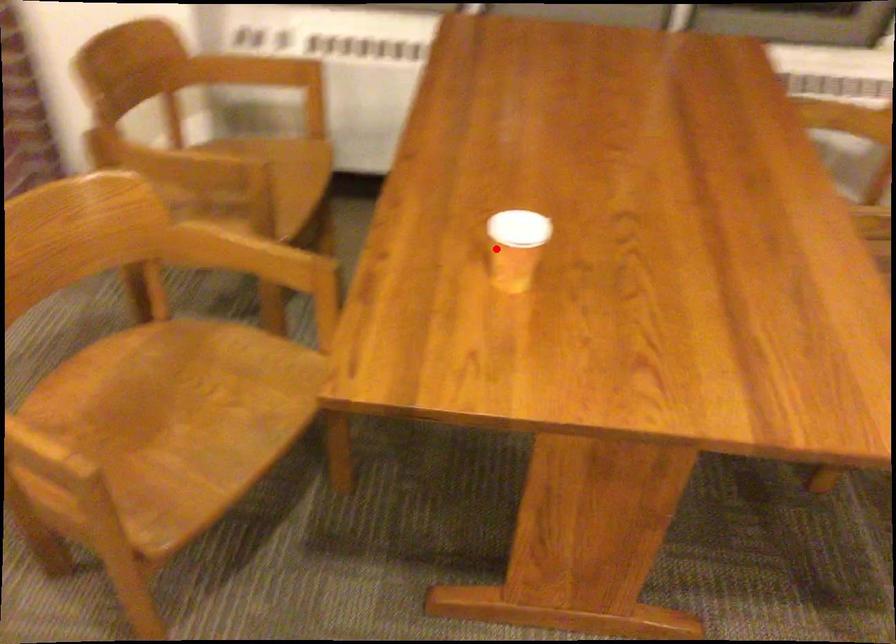
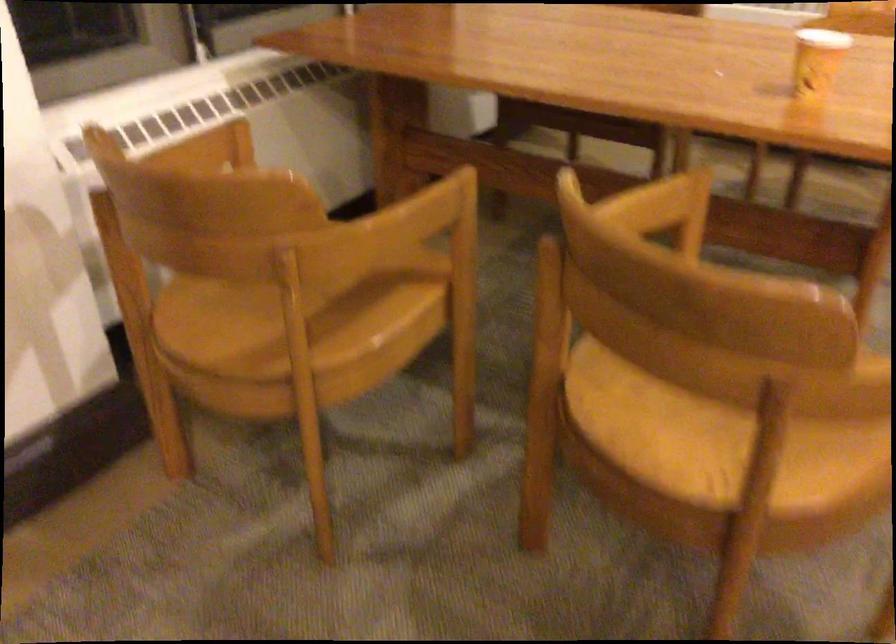
Question: I am providing you with two images of the same scene from different viewpoints. A red point is shown in image1. For the corresponding object point in image2, is it positioned nearer or farther from the camera?

Choices:
 (A) Nearer
 (B) Farther

Answer: (B)